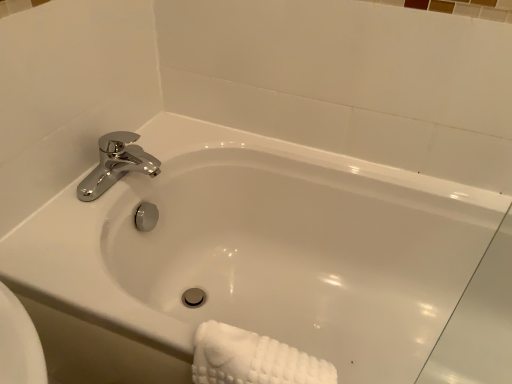
Question: From a real-world perspective, is white textured towel at lower right physically located above or below chrome metallic faucet at upper left?

Choices:
 (A) below
 (B) above

Answer: (A)

Question: Considering the positions of white textured towel at lower right and chrome metallic faucet at upper left in the image, is white textured towel at lower right bigger or smaller than chrome metallic faucet at upper left?

Choices:
 (A) small
 (B) big

Answer: (B)

Question: Estimate the real-world distances between objects in this image. Which object is closer to the white glossy bathtub at center?

Choices:
 (A) chrome metallic faucet at upper left
 (B) white textured towel at lower right

Answer: (A)

Question: Which is farther from the chrome metallic faucet at upper left?

Choices:
 (A) white glossy bathtub at center
 (B) white textured towel at lower right

Answer: (B)